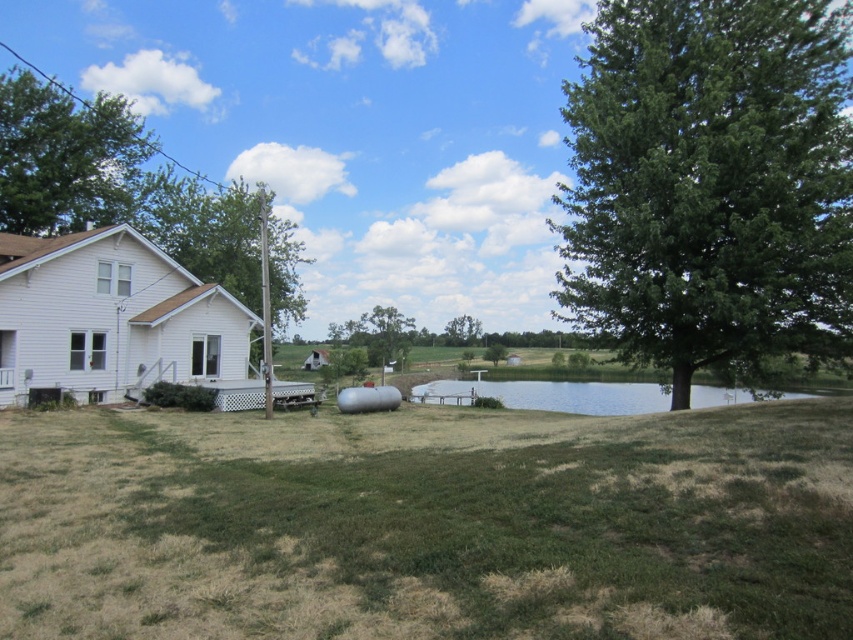
You are planning to install a new satellite dish on the highest point between the green leafy tree at upper left and the clear water at center. Which object should you choose for installation?

The green leafy tree at upper left has a greater height compared to the clear water at center, so you should install the satellite dish on the green leafy tree at upper left.